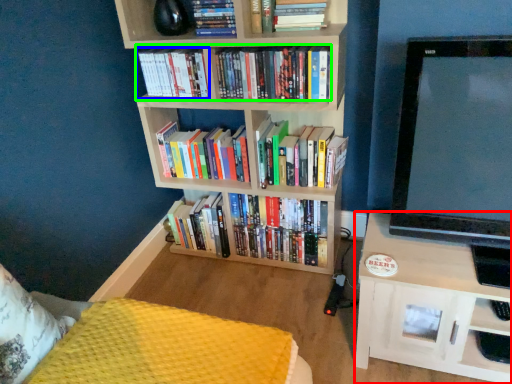
Question: Which is nearer to the shelf (highlighted by a red box)? book (highlighted by a blue box) or book (highlighted by a green box).

Choices:
 (A) book
 (B) book

Answer: (B)